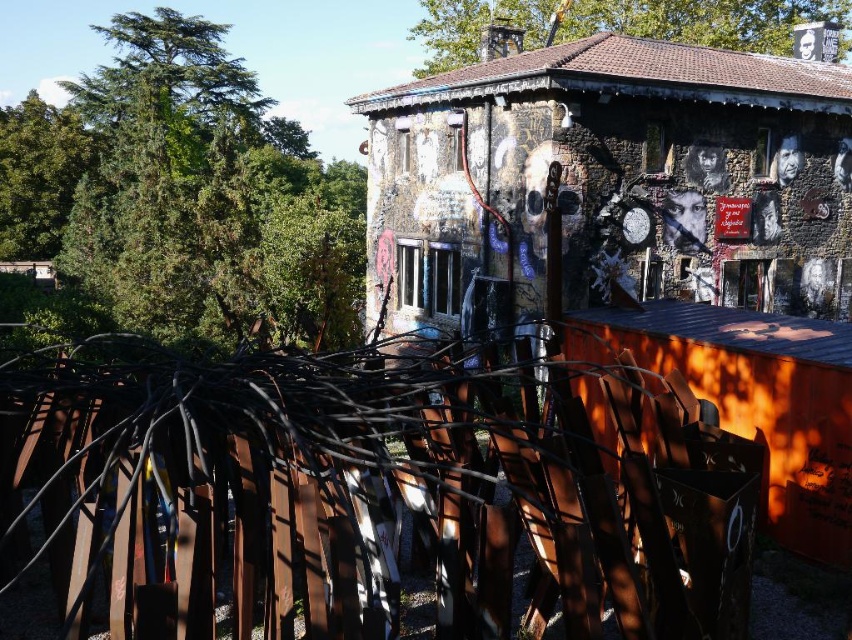
Which is behind, point (108, 246) or point (22, 138)?

The point (22, 138) is behind.

Which is in front, point (216, 52) or point (10, 193)?

Point (10, 193)

In order to click on green leafy tree at upper left in this screenshot , I will do `click(181, 198)`.

Can you confirm if rusty metal fence at center is positioned to the left of green leafy tree at upper center?

Correct, you'll find rusty metal fence at center to the left of green leafy tree at upper center.

Between point (476, 516) and point (645, 10), which one is positioned in front?

Point (476, 516) is in front.

Does point (337, 461) come farther from viewer compared to point (436, 49)?

No, it is not.

This screenshot has height=640, width=852. Find the location of `rusty metal fence at center`. rusty metal fence at center is located at coordinates (355, 493).

Can you confirm if green leafy tree at upper left is shorter than green leafy tree at upper center?

No.

Does green leafy tree at upper left appear on the right side of green leafy tree at upper center?

No, green leafy tree at upper left is not to the right of green leafy tree at upper center.

Image resolution: width=852 pixels, height=640 pixels. I want to click on green leafy tree at upper left, so click(x=181, y=198).